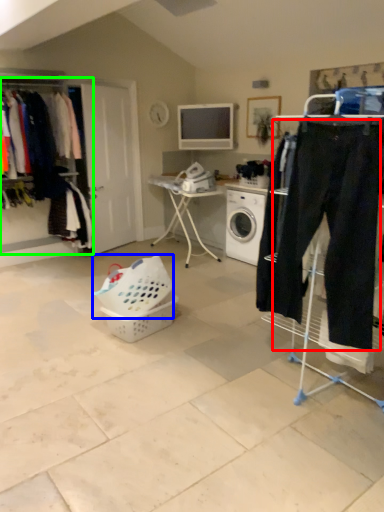
Question: Based on their relative distances, which object is farther from sweat pant (highlighted by a red box)? Choose from basket (highlighted by a blue box) and closet (highlighted by a green box).

Choices:
 (A) basket
 (B) closet

Answer: (B)